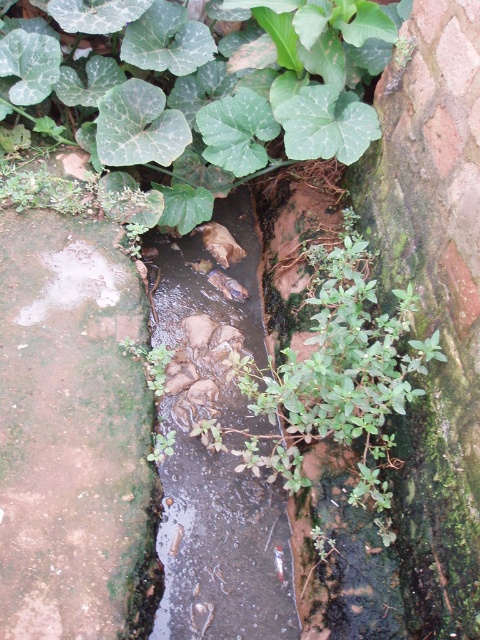
You are a small frog trying to jump across the channel. You see a green leafy plant at upper center and clear water at center. Which object should you jump towards to land safely?

The clear water at center is behind the green leafy plant at upper center, so the frog should jump towards the green leafy plant at upper center to land safely.

You are a small frog trying to jump from the green leafy plant at upper center to the clear water at center. Can you make the jump without falling into the murky water?

The green leafy plant at upper center is to the left of clear water at center, so the frog can jump directly to the clear water at center without falling into the murky water.

You are a small frog that can jump 10 cm. You are currently on the green leafy plant at upper center and want to reach the clear water at center. Can you make the jump?

The green leafy plant at upper center is wider than the clear water at center. Since the frog can jump 10 cm, it can easily jump from the green leafy plant at upper center to the clear water at center as the distance between them is likely within its jumping range.